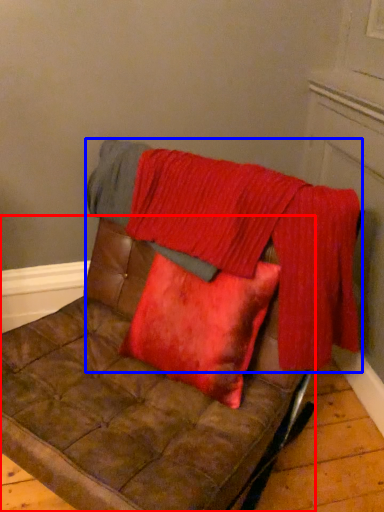
Question: Among these objects, which one is nearest to the camera, furniture (highlighted by a red box) or blanket (highlighted by a blue box)?

Choices:
 (A) furniture
 (B) blanket

Answer: (A)